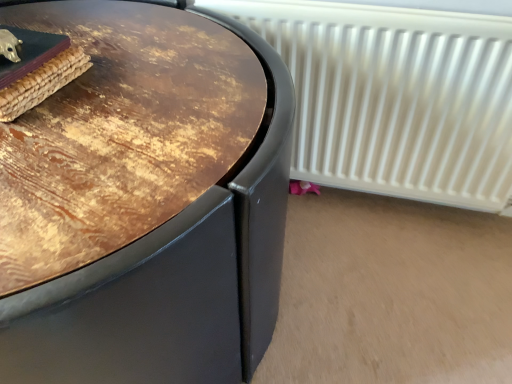
Image resolution: width=512 pixels, height=384 pixels. Identify the location of vacant area situated below white matte radiator at upper right (from a real-world perspective). (383, 211).